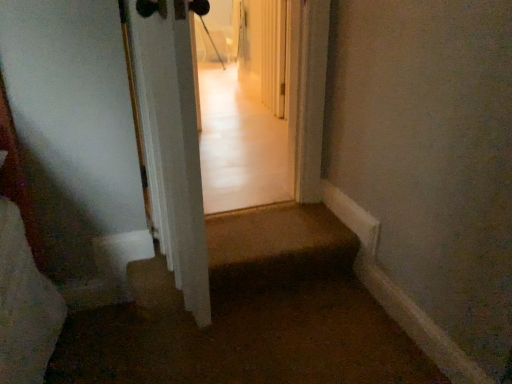
Question: In terms of height, does brown carpet at lower center look taller or shorter compared to white glossy door at center?

Choices:
 (A) tall
 (B) short

Answer: (B)

Question: From a real-world perspective, is brown carpet at lower center positioned above or below white glossy door at center?

Choices:
 (A) below
 (B) above

Answer: (A)

Question: Is brown carpet at lower center wider or thinner than white glossy door at center?

Choices:
 (A) thin
 (B) wide

Answer: (B)

Question: Is white glossy door at center inside or outside of brown carpet at lower center?

Choices:
 (A) outside
 (B) inside

Answer: (A)

Question: Looking at their shapes, would you say white glossy door at center is wider or thinner than brown carpet at lower center?

Choices:
 (A) wide
 (B) thin

Answer: (B)

Question: From the image's perspective, is white glossy door at center located above or below brown carpet at lower center?

Choices:
 (A) below
 (B) above

Answer: (B)

Question: Considering the relative positions of white glossy door at center and brown carpet at lower center in the image provided, is white glossy door at center to the left or to the right of brown carpet at lower center?

Choices:
 (A) right
 (B) left

Answer: (B)